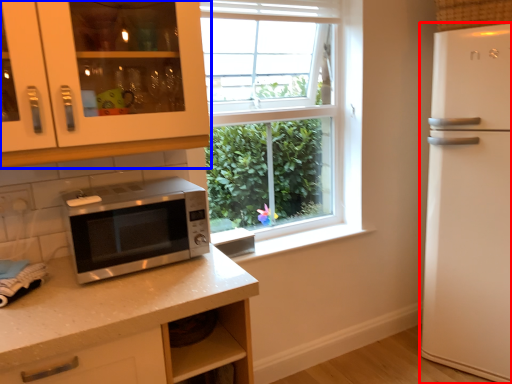
Question: Which point is closer to the camera, refrigerator (highlighted by a red box) or cabinetry (highlighted by a blue box)?

Choices:
 (A) refrigerator
 (B) cabinetry

Answer: (B)